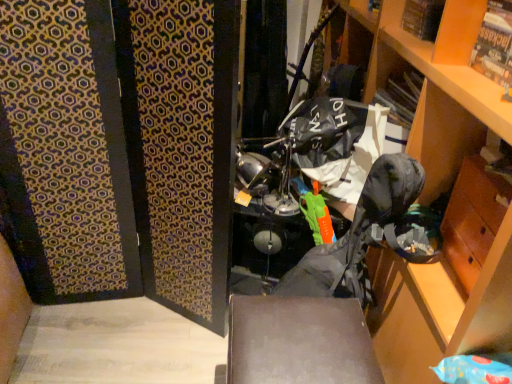
Question: From a real-world perspective, is wooden cabinet at right positioned above or below matte black box at center?

Choices:
 (A) above
 (B) below

Answer: (A)

Question: From the image's perspective, is wooden cabinet at right positioned above or below matte black box at center?

Choices:
 (A) above
 (B) below

Answer: (A)

Question: Which object is the farthest from the wooden cabinet at right?

Choices:
 (A) matte cardboard magazine at upper right
 (B) matte black box at center
 (C) wooden drawer at lower right
 (D) camouflage fabric folding chair at center

Answer: (B)

Question: Considering the real-world distances, which object is farthest from the wooden drawer at lower right?

Choices:
 (A) matte cardboard magazine at upper right
 (B) wooden cabinet at right
 (C) camouflage fabric folding chair at center
 (D) matte black box at center

Answer: (D)